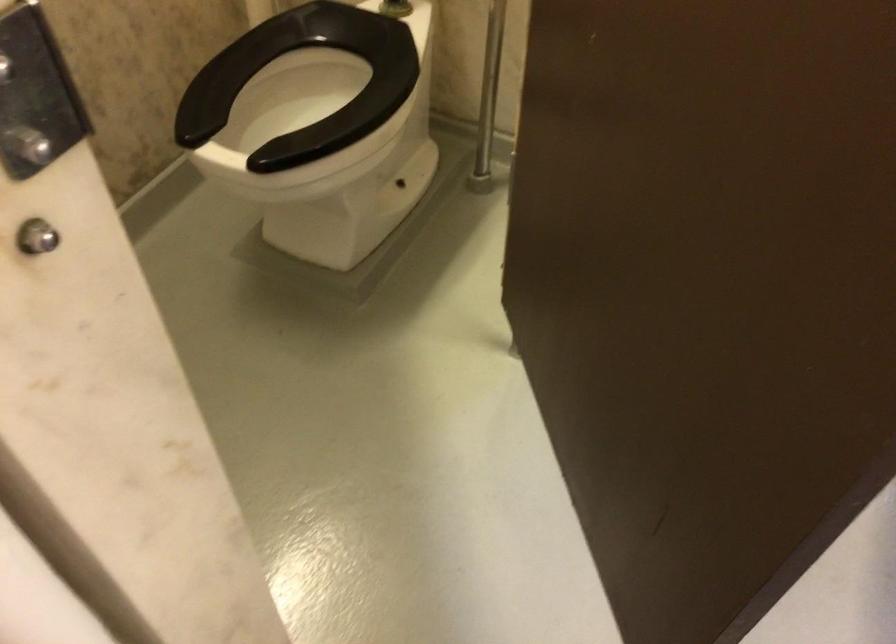
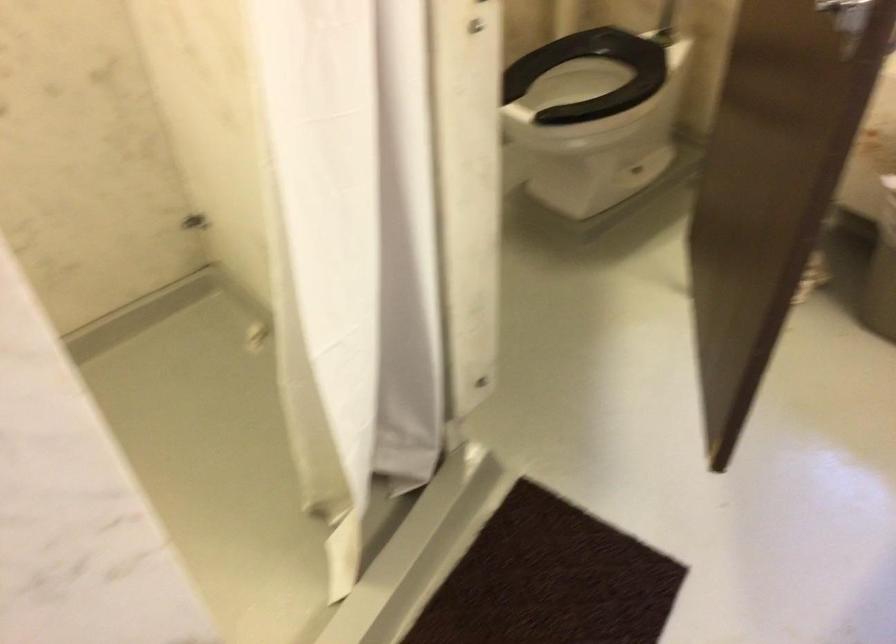
Find the pixel in the second image that matches (313,71) in the first image.

(591, 75)